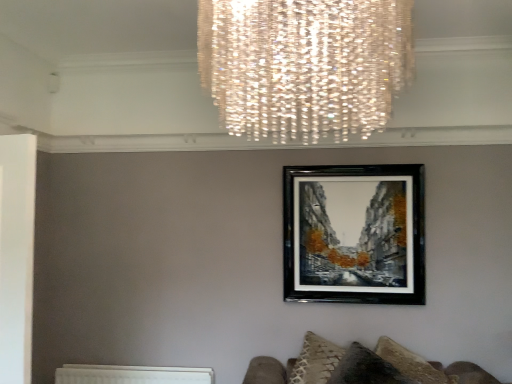
Question: Is velvet textured cushion at lower right positioned with its back to white textured radiator at lower left?

Choices:
 (A) yes
 (B) no

Answer: (B)

Question: Can you confirm if velvet textured cushion at lower right is smaller than white textured radiator at lower left?

Choices:
 (A) yes
 (B) no

Answer: (B)

Question: Could you tell me if velvet textured cushion at lower right is turned towards white textured radiator at lower left?

Choices:
 (A) yes
 (B) no

Answer: (B)

Question: Does velvet textured cushion at lower right lie behind white textured radiator at lower left?

Choices:
 (A) no
 (B) yes

Answer: (A)

Question: Does velvet textured cushion at lower right have a larger size compared to white textured radiator at lower left?

Choices:
 (A) no
 (B) yes

Answer: (B)

Question: Is velvet textured cushion at lower right not within white textured radiator at lower left?

Choices:
 (A) yes
 (B) no

Answer: (A)

Question: Is velvet textured cushion at lower right completely or partially inside white textured radiator at lower left?

Choices:
 (A) yes
 (B) no

Answer: (B)

Question: Can you confirm if white textured radiator at lower left is positioned to the right of velvet textured cushion at lower right?

Choices:
 (A) yes
 (B) no

Answer: (B)

Question: Can you confirm if white textured radiator at lower left is wider than velvet textured cushion at lower right?

Choices:
 (A) yes
 (B) no

Answer: (B)

Question: Considering the relative sizes of white textured radiator at lower left and velvet textured cushion at lower right in the image provided, is white textured radiator at lower left thinner than velvet textured cushion at lower right?

Choices:
 (A) no
 (B) yes

Answer: (B)

Question: Is white textured radiator at lower left far away from velvet textured cushion at lower right?

Choices:
 (A) yes
 (B) no

Answer: (A)

Question: From the image's perspective, is white textured radiator at lower left under velvet textured cushion at lower right?

Choices:
 (A) no
 (B) yes

Answer: (B)

Question: From a real-world perspective, is white textured radiator at lower left located higher than black glossy picture frame at center?

Choices:
 (A) yes
 (B) no

Answer: (B)